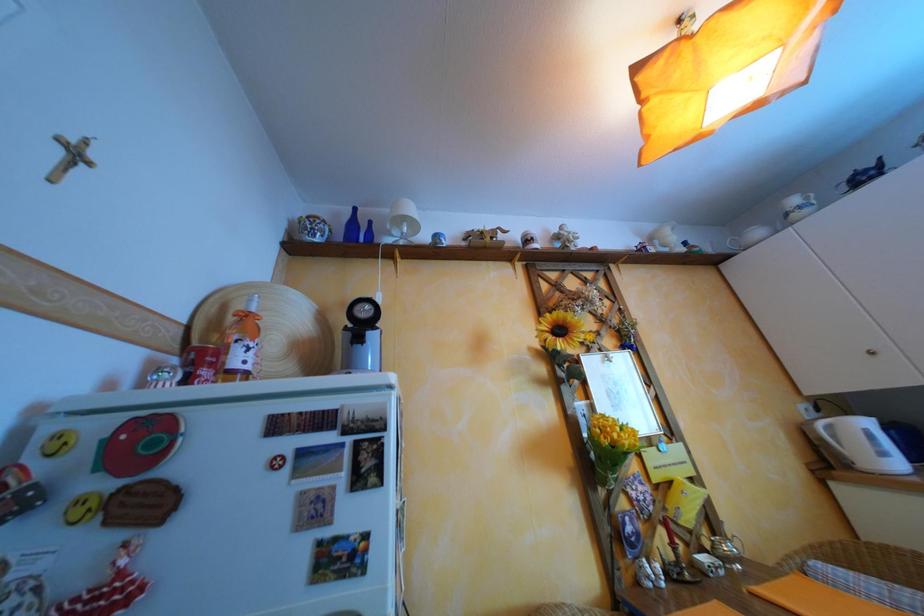
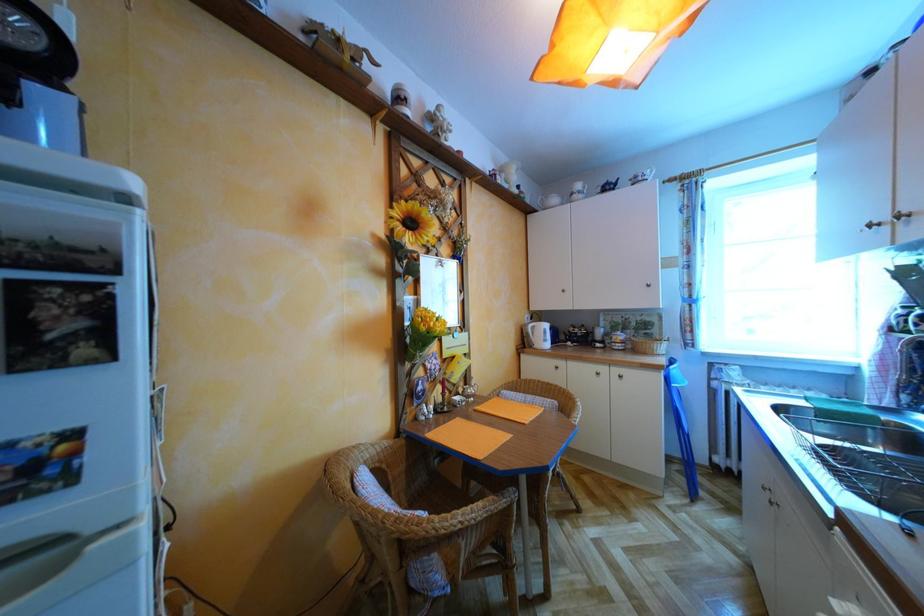
Question: The images are taken continuously from a first-person perspective. In which direction is your viewpoint rotating?

Choices:
 (A) Left
 (B) Right
 (C) Up
 (D) Down

Answer: (B)